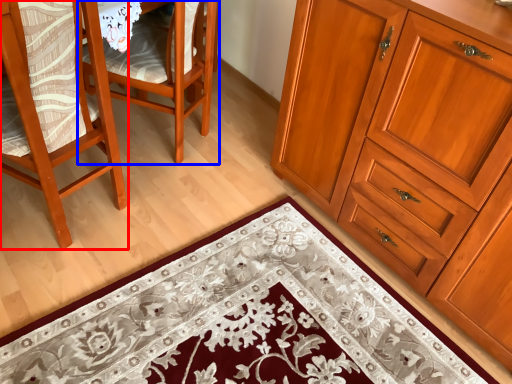
Question: Which object is further to the camera taking this photo, chair (highlighted by a red box) or chair (highlighted by a blue box)?

Choices:
 (A) chair
 (B) chair

Answer: (B)